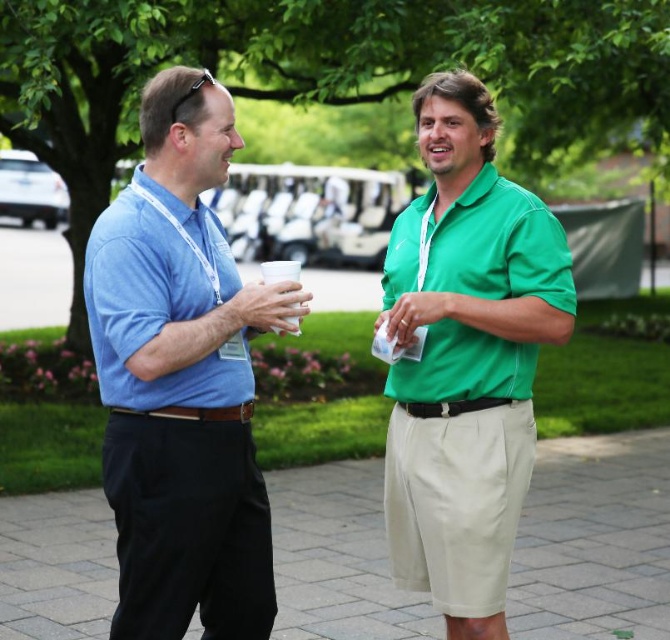
You are standing in front of the two people in the image. Which of the two points, point (279, 563) or point (498, 388), is closer to you?

Point (279, 563) is closer to you because it is further to the viewer than point (498, 388).

You are planning to place a small potted plant on the paved stone pavement at center and the green smooth polo shirt at right. Based on their sizes, which object can accommodate the plant better?

The green smooth polo shirt at right can accommodate the plant better since the paved stone pavement at center has a smaller size compared to it.